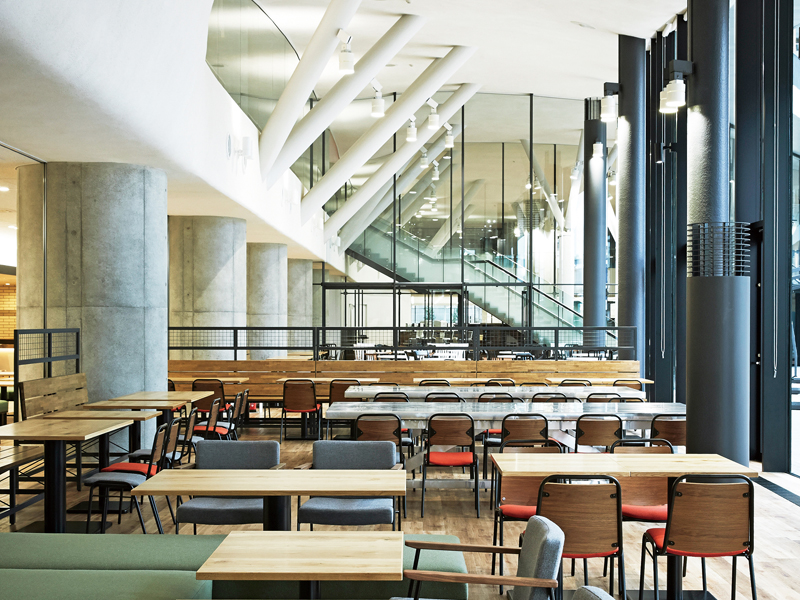
Where is `square table`? The height and width of the screenshot is (600, 800). square table is located at coordinates (178, 393), (170, 402), (142, 416), (74, 432), (284, 564).